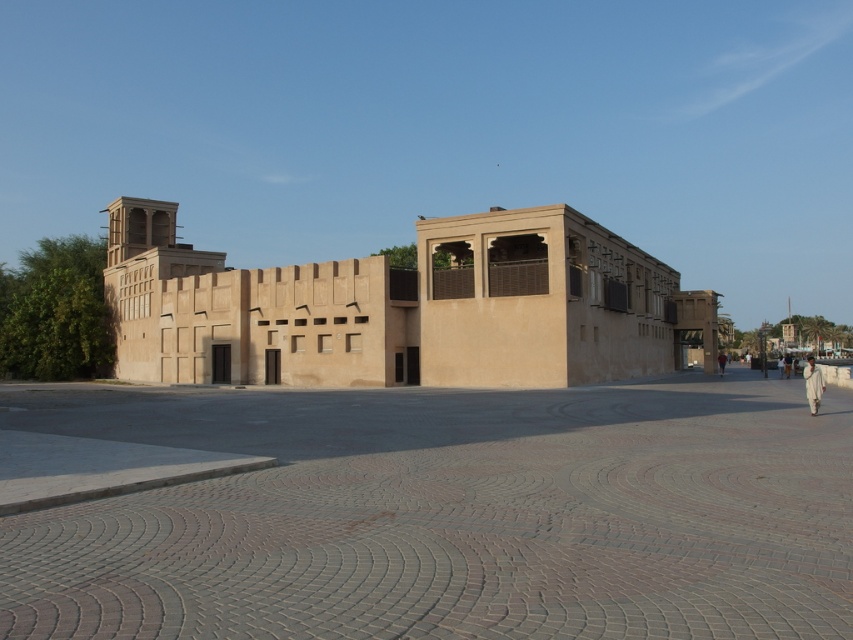
Describe the element at coordinates (787, 364) in the screenshot. I see `light beige sand-colored person at center-right` at that location.

Does light beige sand-colored person at center-right come behind light brown sand-colored person at right?

No, light beige sand-colored person at center-right is closer to the viewer.

The image size is (853, 640). What are the coordinates of `light beige sand-colored person at center-right` in the screenshot? It's located at (787, 364).

Does smooth sandstone plaza at center appear on the left side of light beige sand-colored person at center-right?

Indeed, smooth sandstone plaza at center is positioned on the left side of light beige sand-colored person at center-right.

From the picture: Between smooth sandstone plaza at center and light beige sand-colored person at center-right, which one is positioned higher?

smooth sandstone plaza at center is higher up.

Is point (381, 432) farther from viewer compared to point (791, 368)?

That is False.

Identify the location of smooth sandstone plaza at center. (451, 515).

Measure the distance between smooth sandstone plaza at center and white cotton clothing at right.

12.54 meters

Does smooth sandstone plaza at center have a greater width compared to white cotton clothing at right?

Incorrect, smooth sandstone plaza at center's width does not surpass white cotton clothing at right's.

This screenshot has width=853, height=640. In order to click on smooth sandstone plaza at center in this screenshot , I will do `click(451, 515)`.